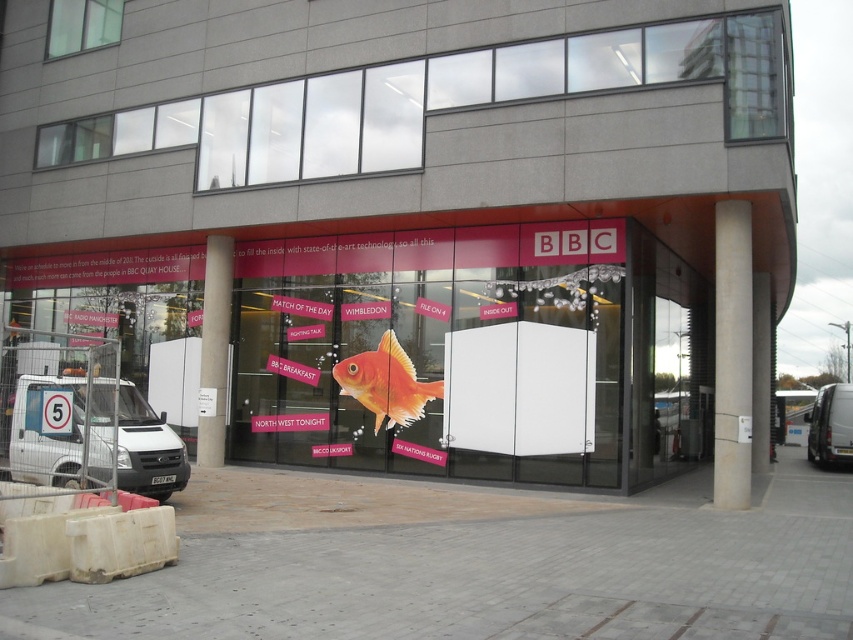
Is point (146, 416) farther from viewer compared to point (379, 355)?

No, (146, 416) is in front of (379, 355).

Which is below, white matte van at left or matte orange fish at center?

white matte van at left is lower down.

Which is behind, point (115, 481) or point (351, 369)?

The point (351, 369) is behind.

I want to click on white matte van at left, so click(148, 449).

Is white matte van at left taller than white van at right?

No.

Which of these two, white matte van at left or white van at right, stands taller?

white van at right

Does point (51, 444) come behind point (840, 403)?

No.

Where is `white matte van at left`? Image resolution: width=853 pixels, height=640 pixels. white matte van at left is located at coordinates pos(148,449).

Can you confirm if white smooth pillar at center is bigger than white van at right?

Actually, white smooth pillar at center might be smaller than white van at right.

Does white smooth pillar at center have a greater height compared to white van at right?

Correct, white smooth pillar at center is much taller as white van at right.

Is point (223, 273) positioned in front of point (824, 442)?

Yes, point (223, 273) is in front of point (824, 442).

Where is `white smooth pillar at center`? The image size is (853, 640). white smooth pillar at center is located at coordinates (213, 349).